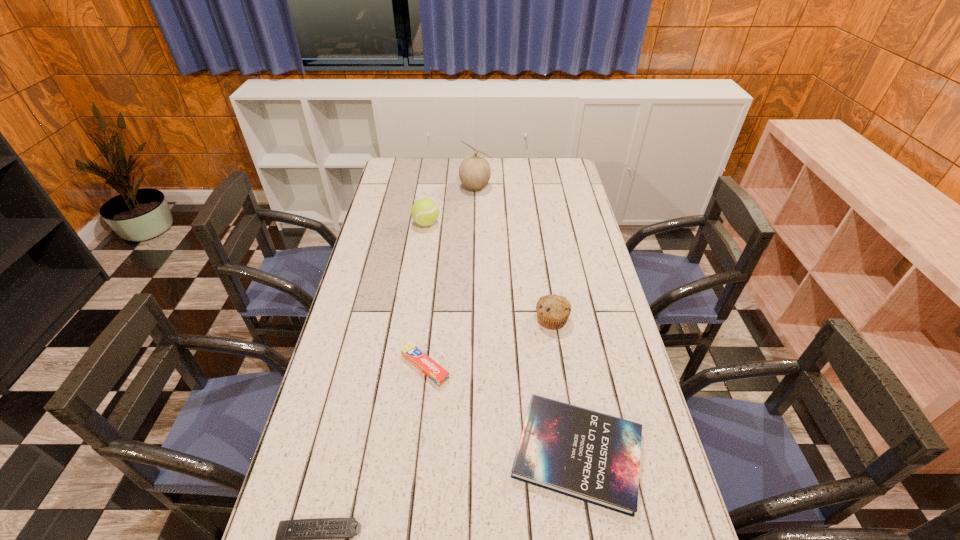
I want to click on the tallest object, so click(x=474, y=172).

Find the location of a particular element. This screenshot has height=540, width=960. cantaloup is located at coordinates (474, 172).

Find the location of a particular element. Image resolution: width=960 pixels, height=540 pixels. the fifth nearest object is located at coordinates (425, 212).

Identify the location of the fifth shortest object. (425, 212).

You are a GUI agent. You are given a task and a screenshot of the screen. Output one action in this format:
    pyautogui.click(x=<x>, y=<y>)
    Task: Click on the muffin
    
    Given the screenshot: What is the action you would take?
    pyautogui.click(x=553, y=311)

This screenshot has height=540, width=960. What are the coordinates of `the fourth nearest object` in the screenshot? It's located at point(553,311).

At what (x,y) coordinates should I click in order to perform the action: click on the fourth farthest object. Please return your answer as a coordinate pair (x, y). The width and height of the screenshot is (960, 540). Looking at the image, I should click on (413, 354).

At what (x,y) coordinates should I click in order to perform the action: click on hardback book. Please return your answer as a coordinate pair (x, y). The height and width of the screenshot is (540, 960). Looking at the image, I should click on (594, 457).

What are the coordinates of `vacant point located 0.380m on the right of the cantaloup` in the screenshot? It's located at (577, 187).

I want to click on free space located on the front of the second farthest object, so click(x=415, y=302).